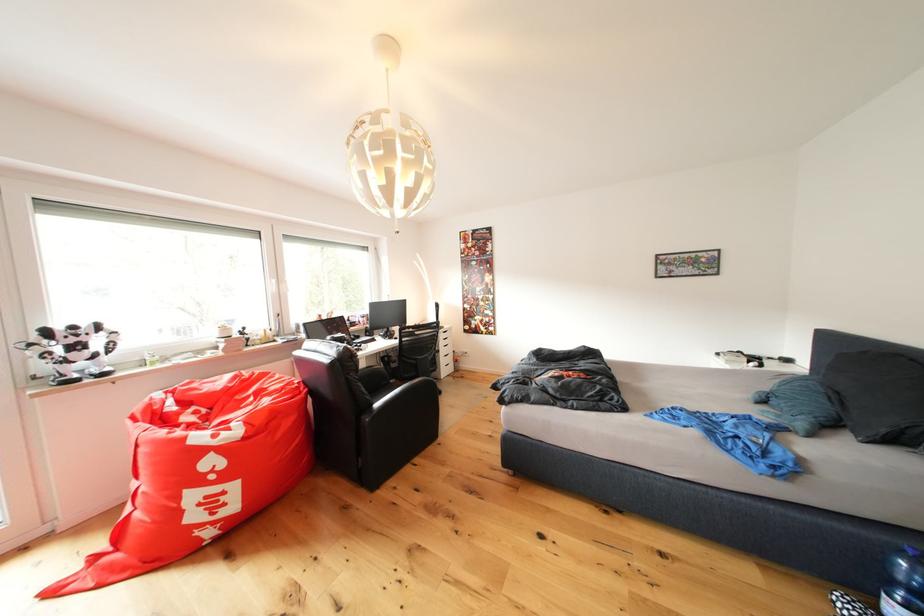
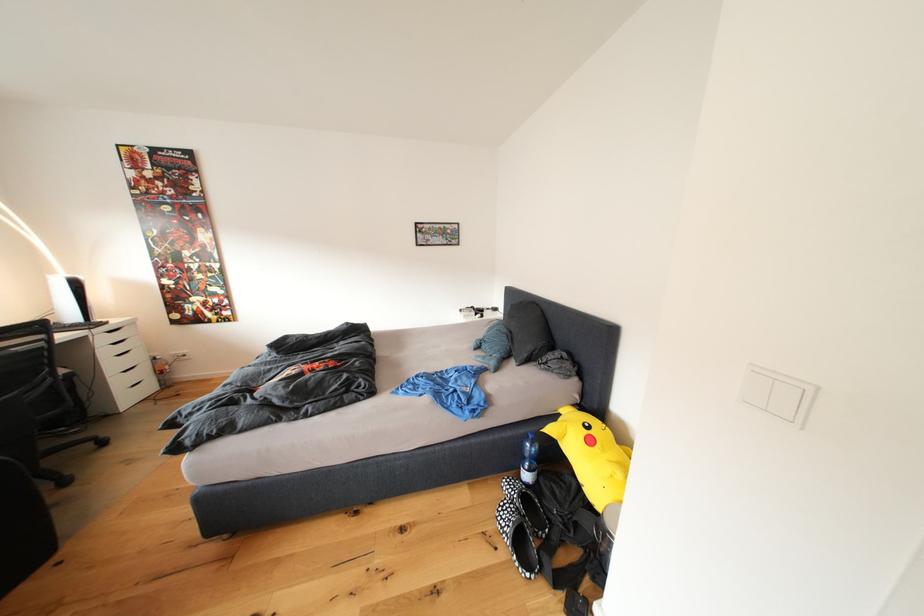
Locate, in the second image, the point that corresponds to the point at 452,355 in the first image.

(120, 370)